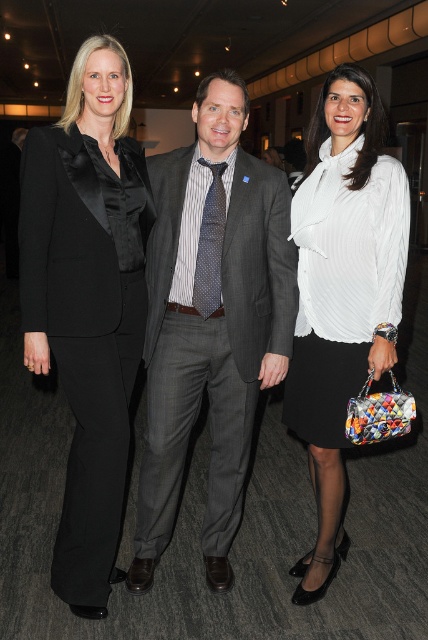
You are standing in a dimly lit modern venue and see the black satin blazer at left and the white pleated blouse at center. Which clothing item is positioned to the left of the other?

The black satin blazer at left is positioned to the left of the white pleated blouse at center.

In the image, there are three people. The person on the left is wearing a black satin blazer. The person in the center is wearing a gray pinstripe suit. The person on the right is wearing a red dress. The black satin blazer at left is represented by point (86,328). The gray pinstripe suit at center is represented by point 0.487, 0.231. The red dress at right is represented by point 0.459, 0.198. If you were to draw a straight line from the black satin blazer at left to the red dress at right, would it 0

The straight line from the black satin blazer at left to the red dress at right would pass through the gray pinstripe suit at center because the points are aligned along a straight path.

You are a photographer at a formal event. You need to capture a photo of both the gray pinstripe suit at center and the white pleated blouse at center. The camera has a minimum focus distance of 40 centimeters. Can you take a photo of both subjects without moving the camera?

The gray pinstripe suit at center is 38.10 centimeters away from the white pleated blouse at center. Since the distance between them is less than the camera minimum focus distance of 40 centimeters, you cannot take a photo of both subjects without moving the camera.